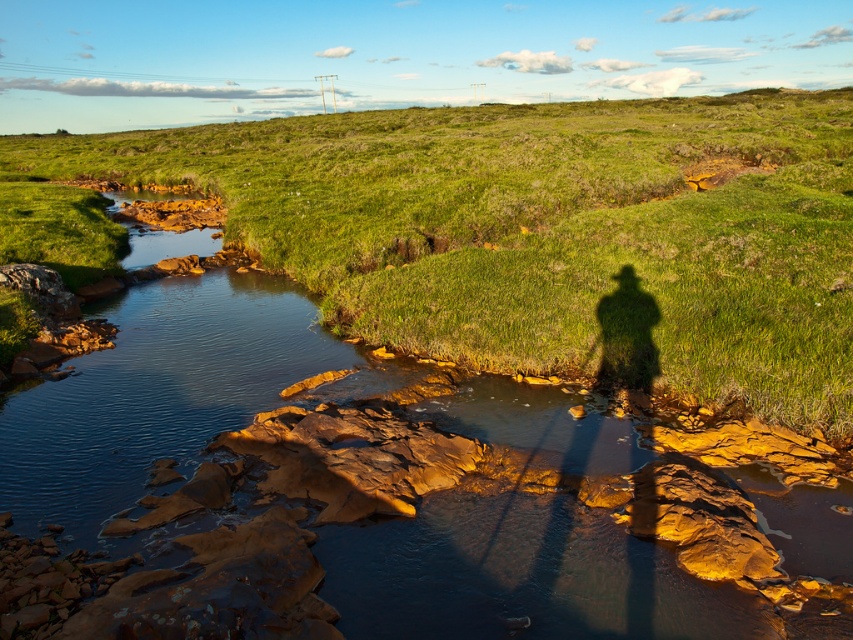
Question: Does green grassy at upper center appear over smooth rock stream at center?

Choices:
 (A) yes
 (B) no

Answer: (A)

Question: Does green grassy at upper center appear on the left side of smooth rock stream at center?

Choices:
 (A) yes
 (B) no

Answer: (B)

Question: Which of the following is the farthest from the observer?

Choices:
 (A) (337, 388)
 (B) (840, 195)

Answer: (B)

Question: Does green grassy at upper center have a greater width compared to smooth rock stream at center?

Choices:
 (A) yes
 (B) no

Answer: (A)